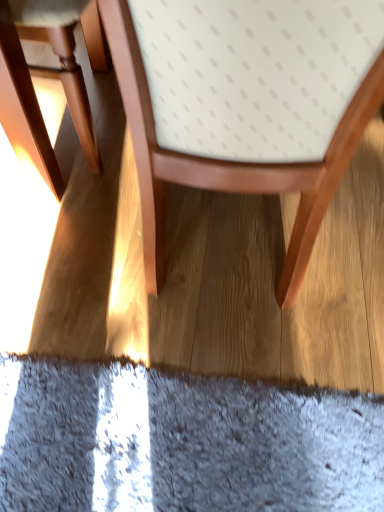
The height and width of the screenshot is (512, 384). I want to click on free point in front of wooden chair at center, the second chair in the left-to-right sequence, so click(x=229, y=410).